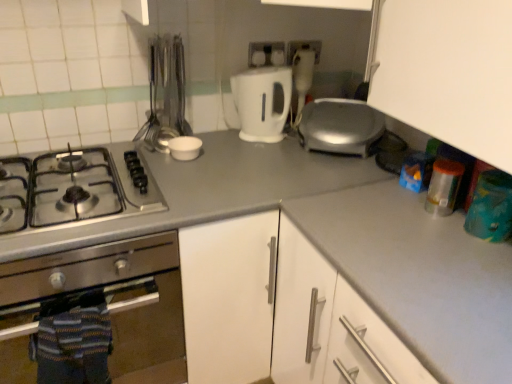
Question: Is stainless steel oven at left, which ranks as the 1th kitchen appliance in bottom-to-top order, bigger or smaller than white plastic electric outlet at upper center, the 1th electric outlet from the left?

Choices:
 (A) small
 (B) big

Answer: (B)

Question: Considering the positions of point (157, 244) and point (258, 48), is point (157, 244) closer or farther from the camera than point (258, 48)?

Choices:
 (A) farther
 (B) closer

Answer: (B)

Question: Estimate the real-world distances between objects in this image. Which object is farther from the white plastic electric outlet at upper center, the 1th electric outlet from the left?

Choices:
 (A) metallic utensils at upper left
 (B) white matte bowl at center
 (C) white glossy electric kettle at center, which is the first kitchen appliance in right-to-left order
 (D) gray matte countertop at center
 (E) white matte counter top at center

Answer: (E)

Question: Considering the real-world distances, which object is closest to the stainless steel gas stove at left?

Choices:
 (A) white matte bowl at center
 (B) white plastic electric outlet at upper center, the 1th electric outlet positioned from the right
 (C) white matte counter top at center
 (D) gray matte countertop at center
 (E) metallic utensils at upper left

Answer: (D)